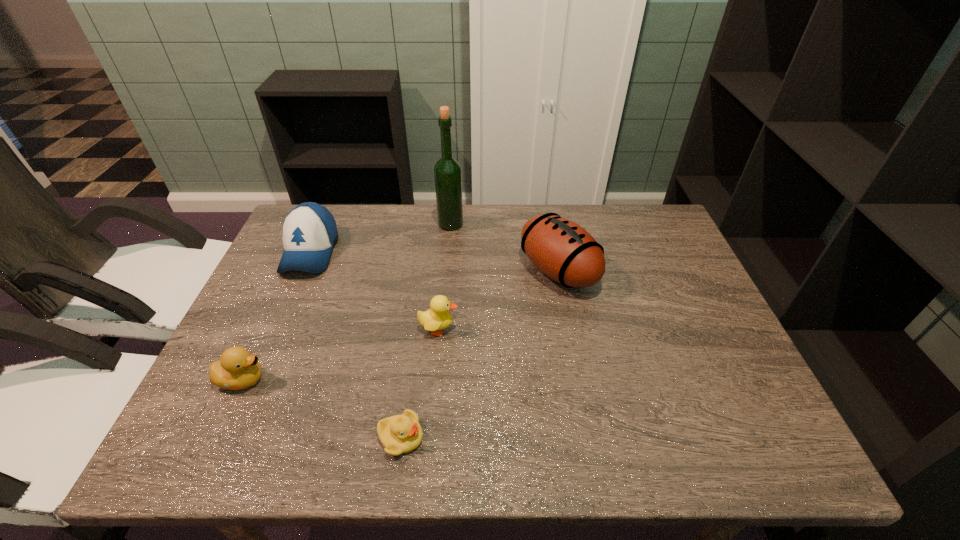
This screenshot has width=960, height=540. I want to click on vacant space that is in between the tallest object and the second tallest object, so click(505, 247).

At what (x,y) coordinates should I click in order to perform the action: click on free spot between the shortest duckling and the football (American). Please return your answer as a coordinate pair (x, y). The image size is (960, 540). Looking at the image, I should click on (480, 354).

The height and width of the screenshot is (540, 960). I want to click on blank region between the fifth shortest object and the leftmost duckling, so click(400, 325).

The image size is (960, 540). Find the location of `vacant area between the liquor and the rightmost object`. vacant area between the liquor and the rightmost object is located at coordinates (505, 247).

Where is `vacant space that is in between the second nearest duckling and the shortest duckling`? The height and width of the screenshot is (540, 960). vacant space that is in between the second nearest duckling and the shortest duckling is located at coordinates (322, 408).

Find the location of `free space between the leftmost duckling and the tallest object`. free space between the leftmost duckling and the tallest object is located at coordinates (347, 302).

You are a GUI agent. You are given a task and a screenshot of the screen. Output one action in this format:
    pyautogui.click(x=<x>, y=<y>)
    Task: Click on the vacant area between the nearest object and the baseball cap
    The image size is (960, 540).
    Given the screenshot: What is the action you would take?
    pyautogui.click(x=355, y=345)

The image size is (960, 540). I want to click on vacant space that is in between the third nearest object and the second tallest object, so click(498, 300).

Identify which object is the closest to the tallest object. Please provide its 2D coordinates. Your answer should be formatted as a tuple, i.e. [(x, y)], where the tuple contains the x and y coordinates of a point satisfying the conditions above.

[(561, 249)]

Select which object is the fifth closest to the fourth shortest object. Please provide its 2D coordinates. Your answer should be formatted as a tuple, i.e. [(x, y)], where the tuple contains the x and y coordinates of a point satisfying the conditions above.

[(561, 249)]